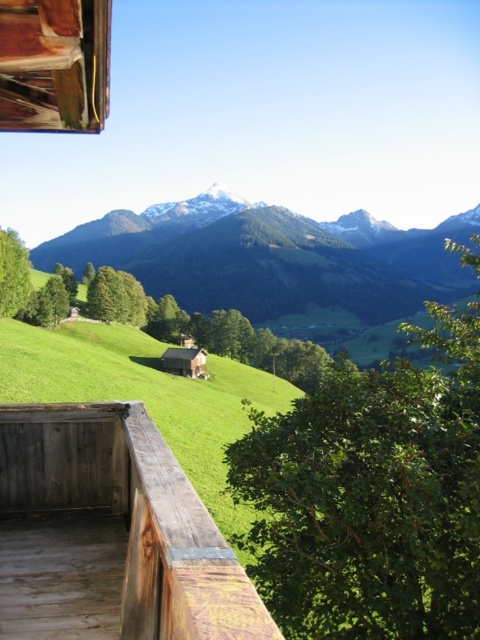
Question: Among these objects, which one is nearest to the camera?

Choices:
 (A) green grassy field at center
 (B) weathered wood deck at lower left

Answer: (B)

Question: Does weathered wood deck at lower left appear on the left side of green grassy field at center?

Choices:
 (A) yes
 (B) no

Answer: (A)

Question: Does weathered wood deck at lower left have a larger size compared to green grassy field at center?

Choices:
 (A) yes
 (B) no

Answer: (B)

Question: Which point is closer to the camera?

Choices:
 (A) (324, 268)
 (B) (179, 529)

Answer: (B)

Question: Which point is closer to the camera?

Choices:
 (A) (139, 456)
 (B) (325, 243)

Answer: (A)

Question: Is weathered wood deck at lower left closer to the viewer compared to green grassy field at center?

Choices:
 (A) no
 (B) yes

Answer: (B)